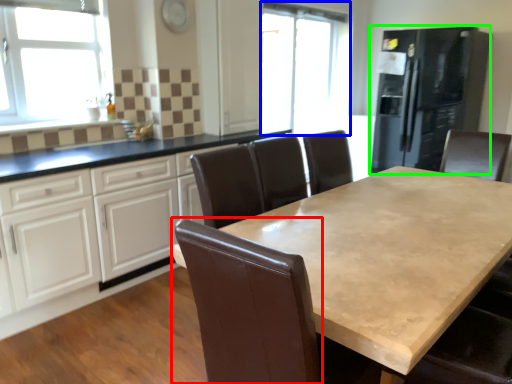
Question: Estimate the real-world distances between objects in this image. Which object is farther from swivel chair (highlighted by a red box), window screen (highlighted by a blue box) or fridge (highlighted by a green box)?

Choices:
 (A) window screen
 (B) fridge

Answer: (A)